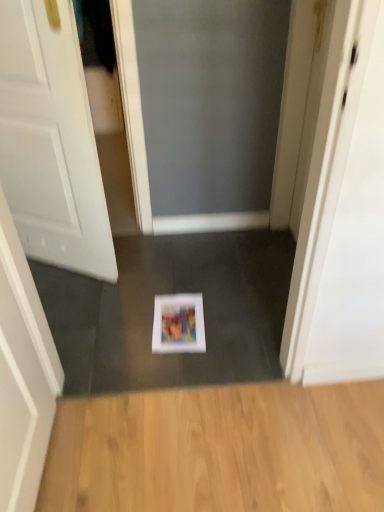
Question: From the image's perspective, is light brown wood flooring at lower center below white glossy screen door at upper right?

Choices:
 (A) yes
 (B) no

Answer: (A)

Question: Does light brown wood flooring at lower center have a lesser width compared to white glossy screen door at upper right?

Choices:
 (A) yes
 (B) no

Answer: (B)

Question: Is light brown wood flooring at lower center far from white glossy screen door at upper right?

Choices:
 (A) yes
 (B) no

Answer: (B)

Question: Is light brown wood flooring at lower center to the right of white glossy screen door at upper right from the viewer's perspective?

Choices:
 (A) no
 (B) yes

Answer: (A)

Question: Can you confirm if light brown wood flooring at lower center is taller than white glossy screen door at upper right?

Choices:
 (A) yes
 (B) no

Answer: (B)

Question: Is white matte door at center situated inside light brown wood flooring at lower center or outside?

Choices:
 (A) inside
 (B) outside

Answer: (B)

Question: In terms of size, does white matte door at center appear bigger or smaller than light brown wood flooring at lower center?

Choices:
 (A) small
 (B) big

Answer: (B)

Question: In terms of height, does white matte door at center look taller or shorter compared to light brown wood flooring at lower center?

Choices:
 (A) short
 (B) tall

Answer: (B)

Question: Considering the positions of white matte door at center and light brown wood flooring at lower center in the image, is white matte door at center wider or thinner than light brown wood flooring at lower center?

Choices:
 (A) wide
 (B) thin

Answer: (B)

Question: From a real-world perspective, is matte paper magazine at center physically located above or below white matte door at center?

Choices:
 (A) above
 (B) below

Answer: (B)

Question: From the image's perspective, is matte paper magazine at center positioned above or below white matte door at center?

Choices:
 (A) above
 (B) below

Answer: (B)

Question: Is point (165, 308) closer or farther from the camera than point (41, 10)?

Choices:
 (A) closer
 (B) farther

Answer: (B)

Question: Is matte paper magazine at center taller or shorter than white matte door at center?

Choices:
 (A) short
 (B) tall

Answer: (A)

Question: Based on their positions, is matte paper magazine at center located to the left or right of light brown wood flooring at lower center?

Choices:
 (A) right
 (B) left

Answer: (B)

Question: In terms of size, does matte paper magazine at center appear bigger or smaller than light brown wood flooring at lower center?

Choices:
 (A) small
 (B) big

Answer: (A)